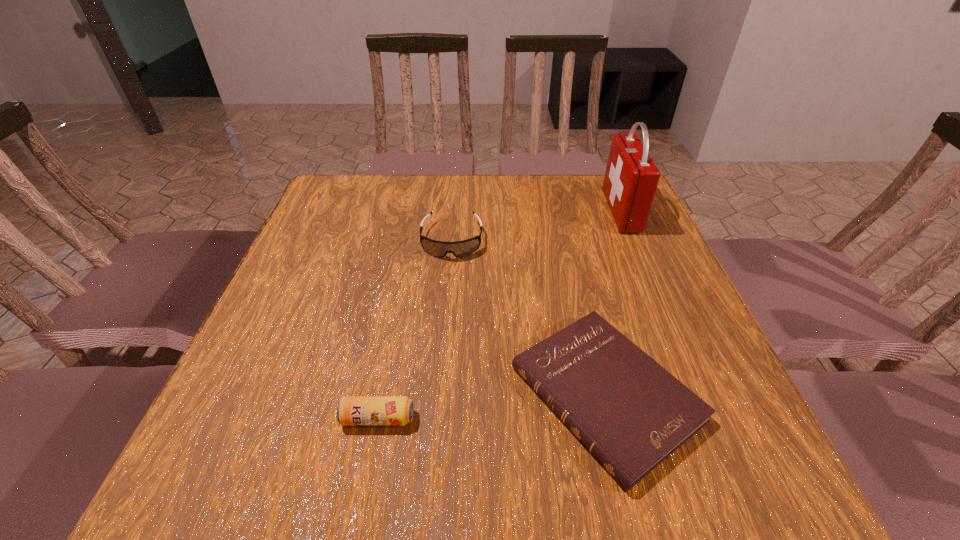
At what (x,y) coordinates should I click in order to perform the action: click on object situated at the far edge. Please return your answer as a coordinate pair (x, y). Looking at the image, I should click on (631, 178).

In order to click on object that is at the near edge in this screenshot , I will do `click(631, 413)`.

Image resolution: width=960 pixels, height=540 pixels. Identify the location of the first-aid kit that is at the right edge. (631, 178).

You are a GUI agent. You are given a task and a screenshot of the screen. Output one action in this format:
    pyautogui.click(x=<x>, y=<y>)
    Task: Click on the hardback book located in the right edge section of the desktop
    This screenshot has height=540, width=960.
    Given the screenshot: What is the action you would take?
    pyautogui.click(x=631, y=413)

Find the location of a particular element. object located in the far right corner section of the desktop is located at coordinates (631, 178).

You are a GUI agent. You are given a task and a screenshot of the screen. Output one action in this format:
    pyautogui.click(x=<x>, y=<y>)
    Task: Click on the object located in the near right corner section of the desktop
    This screenshot has width=960, height=540.
    Given the screenshot: What is the action you would take?
    pyautogui.click(x=631, y=413)

The height and width of the screenshot is (540, 960). In the image, there is a desktop. Identify the location of vacant space at the far edge. (396, 177).

Locate an element on the screen. vacant space at the near edge of the desktop is located at coordinates (324, 476).

The height and width of the screenshot is (540, 960). I want to click on vacant area at the left edge, so click(x=349, y=274).

I want to click on vacant area at the right edge, so click(633, 287).